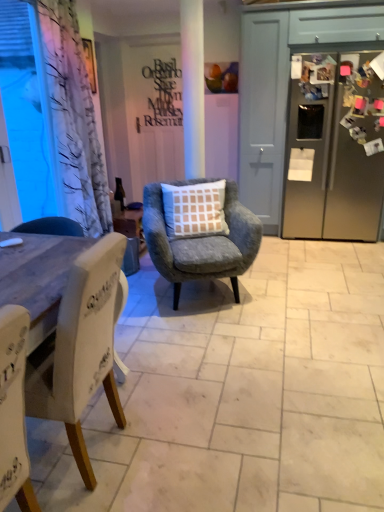
Question: Would you say transparent plastic window screen at left is to the left or to the right of velvet grey armchair with checkered cushion at center, the 1th chair when ordered from back to front, in the picture?

Choices:
 (A) right
 (B) left

Answer: (B)

Question: Looking at their shapes, would you say transparent plastic window screen at left is wider or thinner than velvet grey armchair with checkered cushion at center, which ranks as the 2th chair in front-to-back order?

Choices:
 (A) thin
 (B) wide

Answer: (A)

Question: Which of these objects is positioned farthest from the velvet grey armchair with checkered cushion at center, the second chair in the left-to-right sequence?

Choices:
 (A) satin silver refrigerator at right
 (B) matte black writing at center
 (C) white fabric chair at left, positioned as the 1th chair in front-to-back order
 (D) matte black bottle at center
 (E) transparent plastic window screen at left

Answer: (B)

Question: Which of these objects is positioned closest to the transparent plastic window screen at left?

Choices:
 (A) white fabric chair at left, the 2th chair positioned from the back
 (B) matte black bottle at center
 (C) white matte door at center
 (D) velvet grey armchair with checkered cushion at center, the 1th chair when ordered from back to front
 (E) matte black writing at center

Answer: (D)